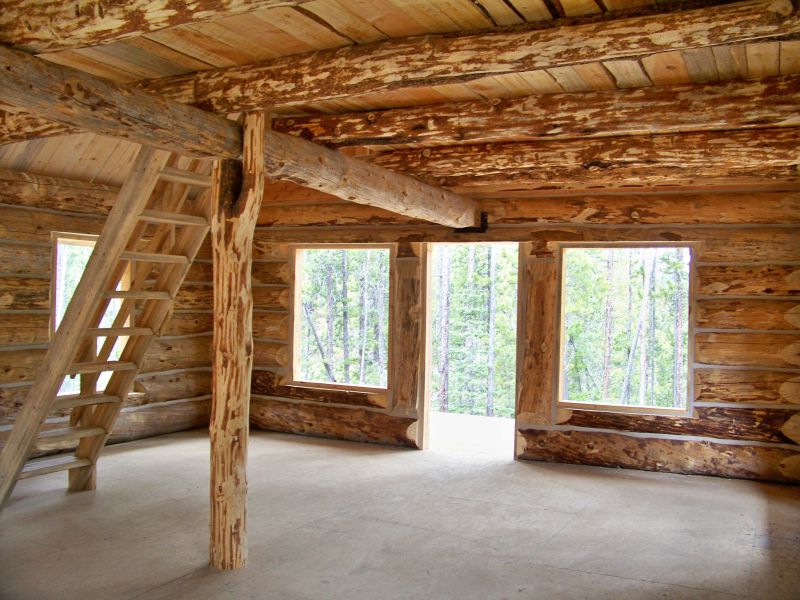
You are a GUI agent. You are given a task and a screenshot of the screen. Output one action in this format:
    pyautogui.click(x=<x>, y=<y>)
    Task: Click on the door opening
    The image size is (800, 600).
    Given the screenshot: What is the action you would take?
    pyautogui.click(x=478, y=330)